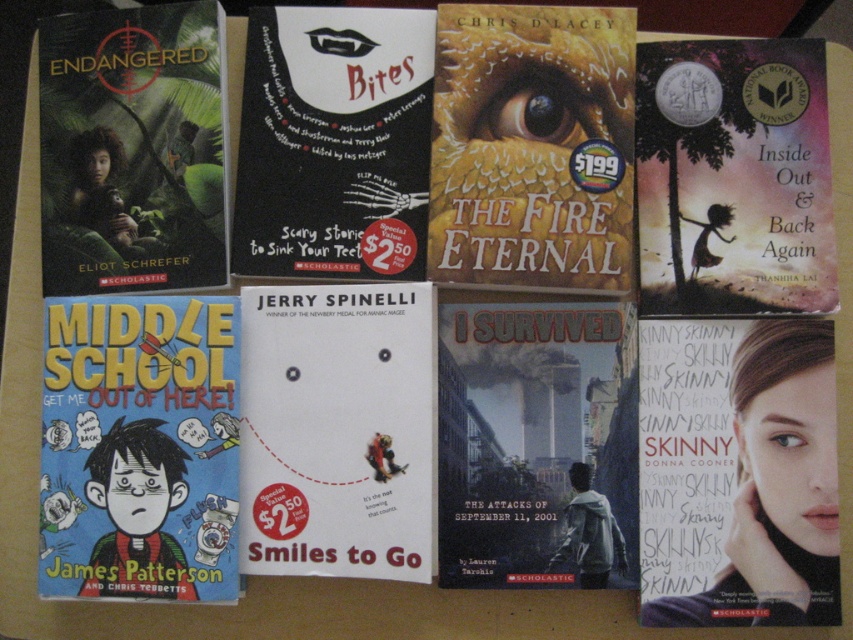
Question: Which object is farther from the camera taking this photo?

Choices:
 (A) matte white book at bottom right
 (B) matte green book at upper left

Answer: (B)

Question: Is matte yellow dragon eye at center further to the viewer compared to matte pink paper at upper right?

Choices:
 (A) yes
 (B) no

Answer: (A)

Question: Does hardcover book at center have a greater width compared to matte green book at upper left?

Choices:
 (A) yes
 (B) no

Answer: (A)

Question: Among these objects, which one is nearest to the camera?

Choices:
 (A) cartoonish paper book at lower left
 (B) black matte book cover at center
 (C) hardcover book at center
 (D) matte pink paper at upper right

Answer: (A)

Question: In this image, where is cartoonish paper book at lower left located relative to white paper book at center?

Choices:
 (A) below
 (B) above

Answer: (A)

Question: Which of the following is the farthest from the observer?

Choices:
 (A) [67, 525]
 (B) [280, 52]
 (C) [657, 557]

Answer: (B)